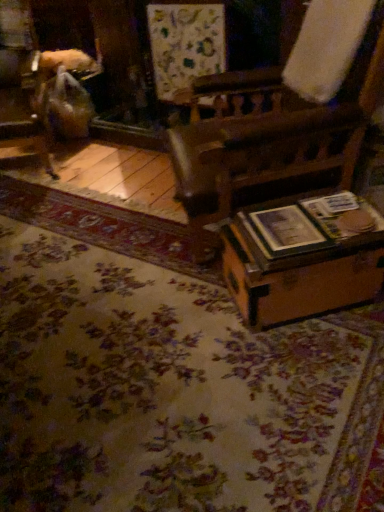
This screenshot has width=384, height=512. What are the coordinates of `empty space that is to the right of wooden chair at left` in the screenshot? It's located at (109, 158).